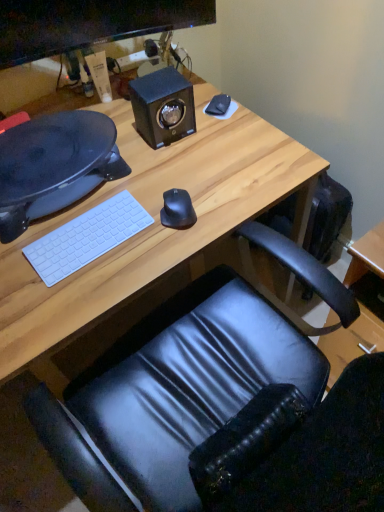
Locate an element on the screen. The width and height of the screenshot is (384, 512). vacant area that lies between black textured speaker at upper center and black glossy speaker at left is located at coordinates (139, 139).